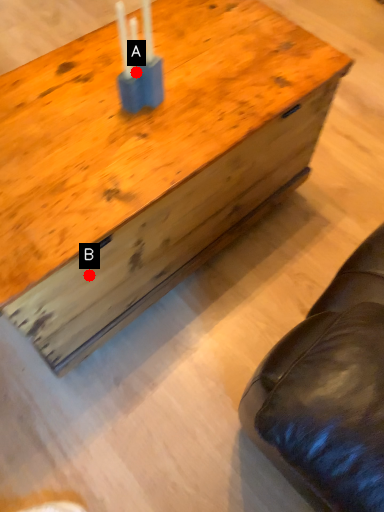
Question: Two points are circled on the image, labeled by A and B beside each circle. Which point appears closest to the camera in this image?

Choices:
 (A) A is closer
 (B) B is closer

Answer: (B)